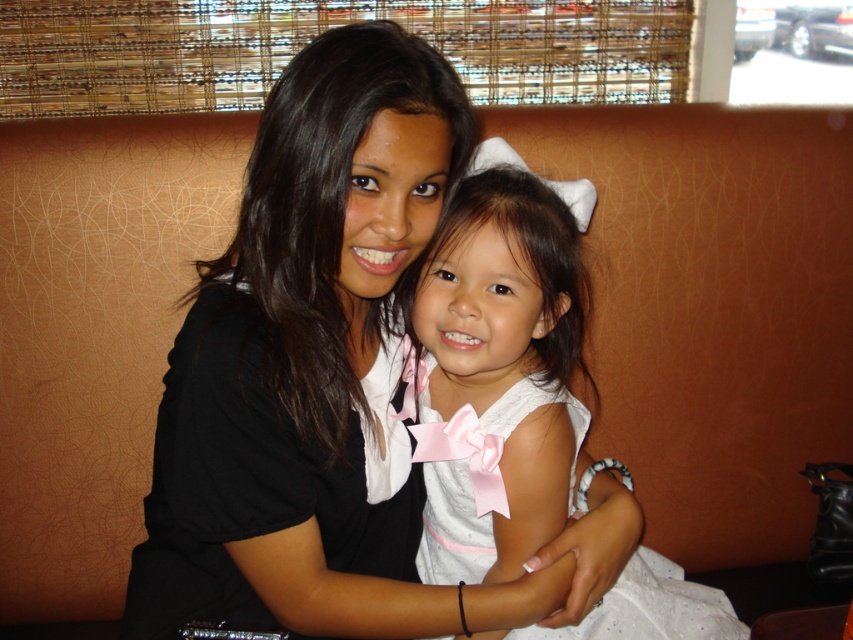
Question: Observing the image, what is the correct spatial positioning of black matte shirt at center in reference to white satin dress at center?

Choices:
 (A) right
 (B) left

Answer: (B)

Question: Is the position of black matte shirt at center less distant than that of white satin dress at center?

Choices:
 (A) no
 (B) yes

Answer: (B)

Question: Which point is farther to the camera?

Choices:
 (A) (337, 625)
 (B) (525, 355)

Answer: (B)

Question: Can you confirm if black matte shirt at center is positioned to the left of white satin dress at center?

Choices:
 (A) no
 (B) yes

Answer: (B)